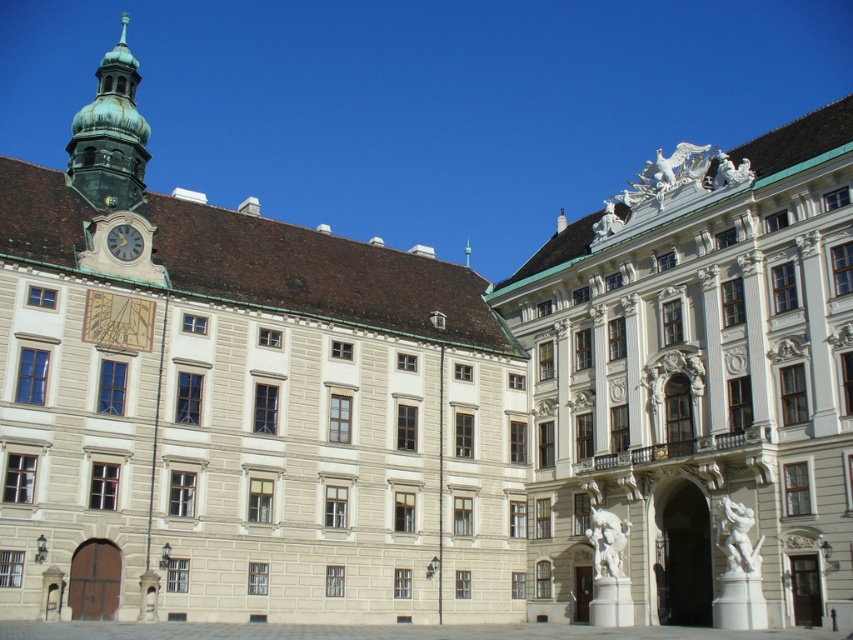
The width and height of the screenshot is (853, 640). I want to click on matte gray clock at upper left, so click(x=125, y=243).

Between point (119, 244) and point (605, 234), which one is positioned in front?

Point (119, 244) is in front.

The width and height of the screenshot is (853, 640). In order to click on matte gray clock at upper left in this screenshot , I will do `click(125, 243)`.

In the scene shown: Is beige stone building at center positioned at the back of white stone palace at right?

Yes, beige stone building at center is further from the viewer.

In the scene shown: Can you confirm if beige stone building at center is positioned to the right of white stone palace at right?

No, beige stone building at center is not to the right of white stone palace at right.

Who is more forward, (96, 330) or (583, 259)?

Positioned in front is point (96, 330).

In order to click on beige stone building at center in this screenshot , I will do `click(242, 406)`.

Is beige stone building at center taller than matte gray clock at upper left?

Indeed, beige stone building at center has a greater height compared to matte gray clock at upper left.

Who is more distant from viewer, (494, 540) or (115, 234)?

Point (494, 540)

Between point (115, 92) and point (128, 227), which one is positioned in front?

Positioned in front is point (128, 227).

This screenshot has height=640, width=853. Find the location of `beige stone building at center`. beige stone building at center is located at coordinates (242, 406).